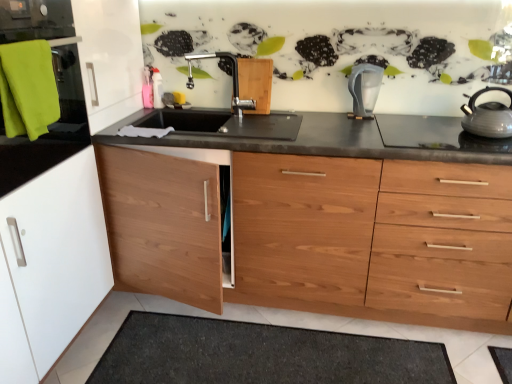
The height and width of the screenshot is (384, 512). Find the location of `vacant area situated below transparent plastic water filter at center (from a real-world perspective)`. vacant area situated below transparent plastic water filter at center (from a real-world perspective) is located at coordinates (361, 114).